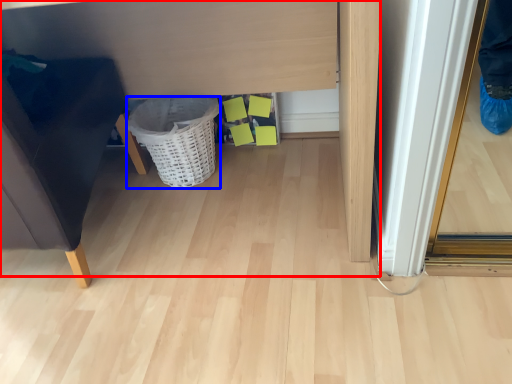
Question: Which point is closer to the camera, vanity (highlighted by a red box) or basket (highlighted by a blue box)?

Choices:
 (A) vanity
 (B) basket

Answer: (A)